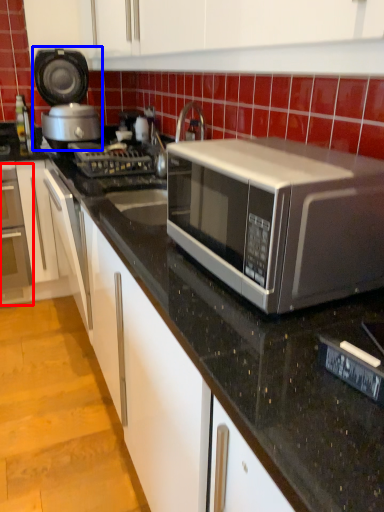
Question: Among these objects, which one is nearest to the camera, oven (highlighted by a red box) or appliance (highlighted by a blue box)?

Choices:
 (A) oven
 (B) appliance

Answer: (B)